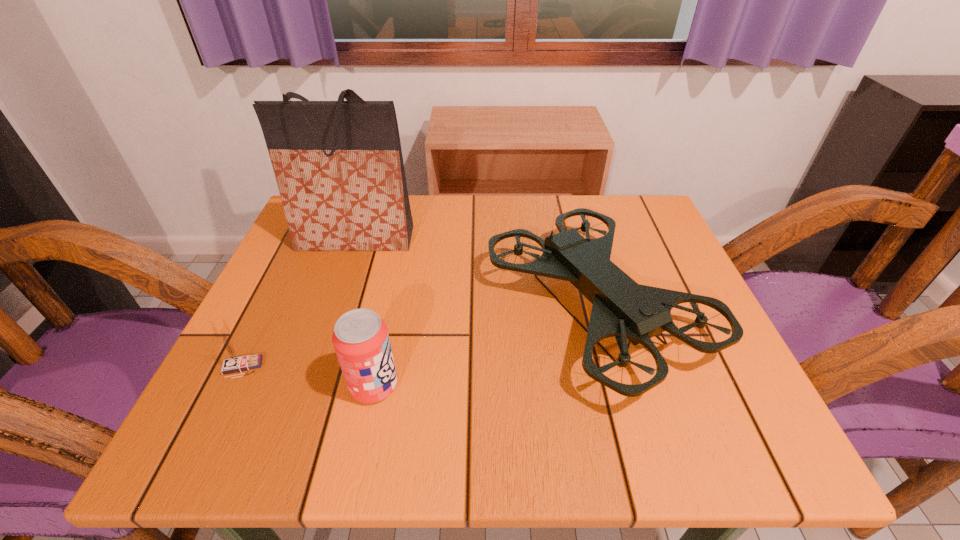
Find the location of a particular element. The image size is (960, 540). free space between the shortest object and the tallest object is located at coordinates (299, 303).

Locate an element on the screen. vacant space that's between the rightmost object and the matchbox is located at coordinates (419, 338).

You are a GUI agent. You are given a task and a screenshot of the screen. Output one action in this format:
    pyautogui.click(x=<x>, y=<y>)
    Task: Click on the vacant region between the tallest object and the shortest object
    The image size is (960, 540).
    Given the screenshot: What is the action you would take?
    pyautogui.click(x=299, y=303)

Select which object is the second closest to the soda can. Please provide its 2D coordinates. Your answer should be formatted as a tuple, i.e. [(x, y)], where the tuple contains the x and y coordinates of a point satisfying the conditions above.

[(234, 362)]

The width and height of the screenshot is (960, 540). Identify the location of object that is the closest one to the second shortest object. (622, 308).

At what (x,y) coordinates should I click in order to perform the action: click on free location that satisfies the following two spatial constraints: 1. on the back side of the matchbox; 2. on the left side of the rightmost object. Please return your answer as a coordinate pair (x, y). This screenshot has width=960, height=540. Looking at the image, I should click on (272, 308).

Where is `free spot that satisfies the following two spatial constraints: 1. on the front-facing side of the drone; 2. on the right side of the tallest object`? The height and width of the screenshot is (540, 960). free spot that satisfies the following two spatial constraints: 1. on the front-facing side of the drone; 2. on the right side of the tallest object is located at coordinates (331, 308).